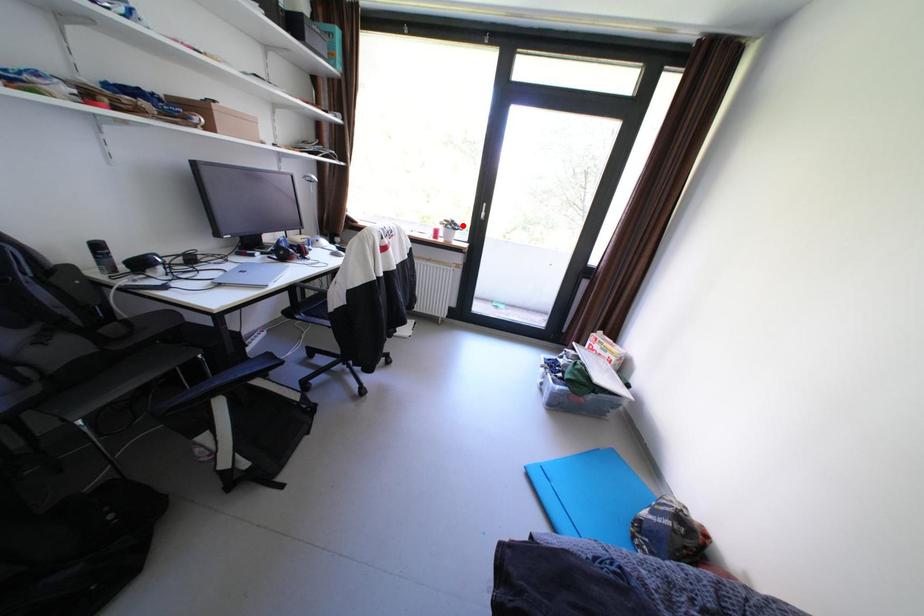
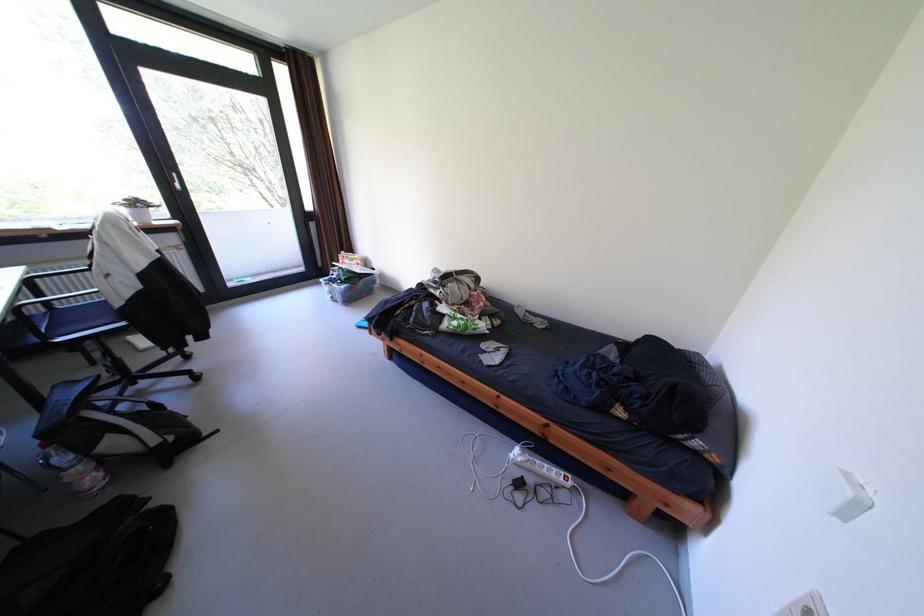
Question: A red point is marked in image1. In image2, is the corresponding 3D point closer to the camera or farther? Reply with the corresponding letter.

Choices:
 (A) The corresponding 3D point is closer.
 (B) The corresponding 3D point is farther.

Answer: (B)